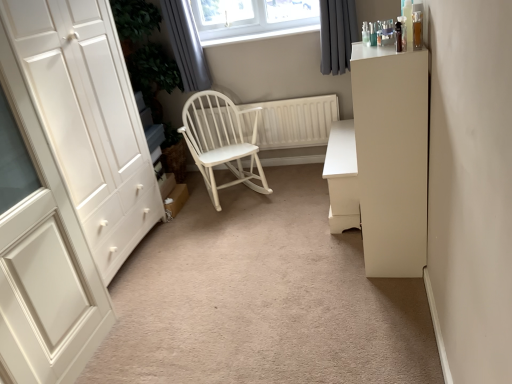
Where is `blank space to the left of white matte chest of drawers at center`? The height and width of the screenshot is (384, 512). blank space to the left of white matte chest of drawers at center is located at coordinates (275, 208).